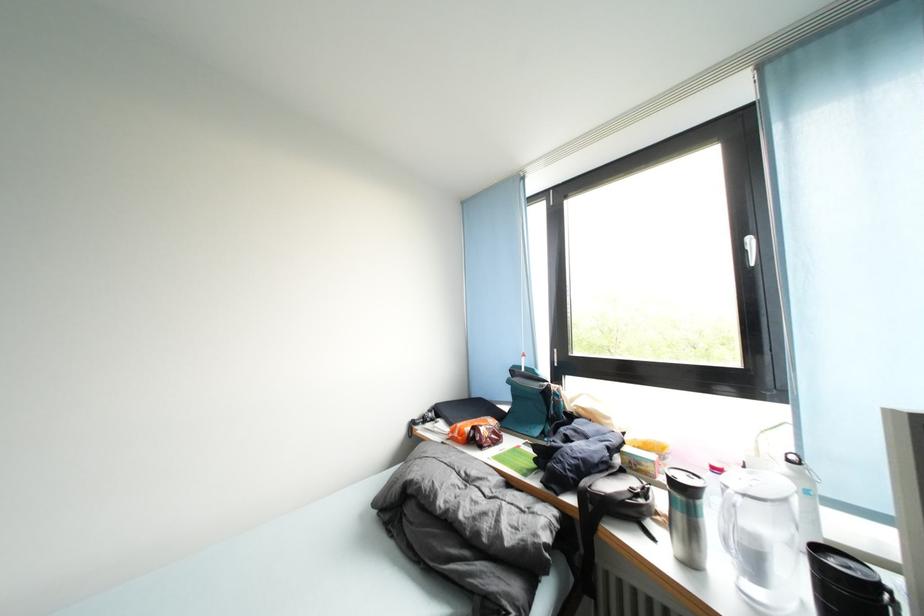
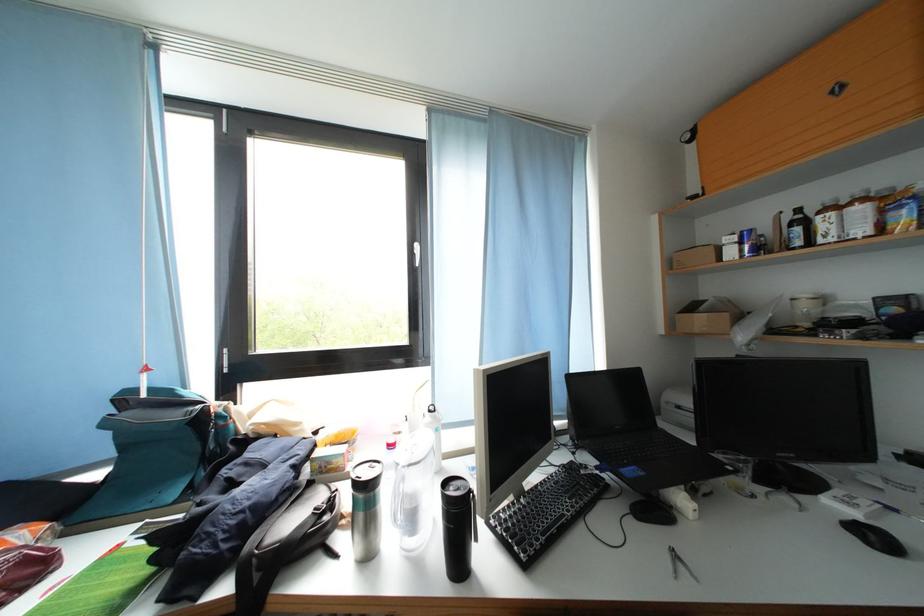
The point at (723, 475) is marked in the first image. Where is the corresponding point in the second image?

(398, 451)